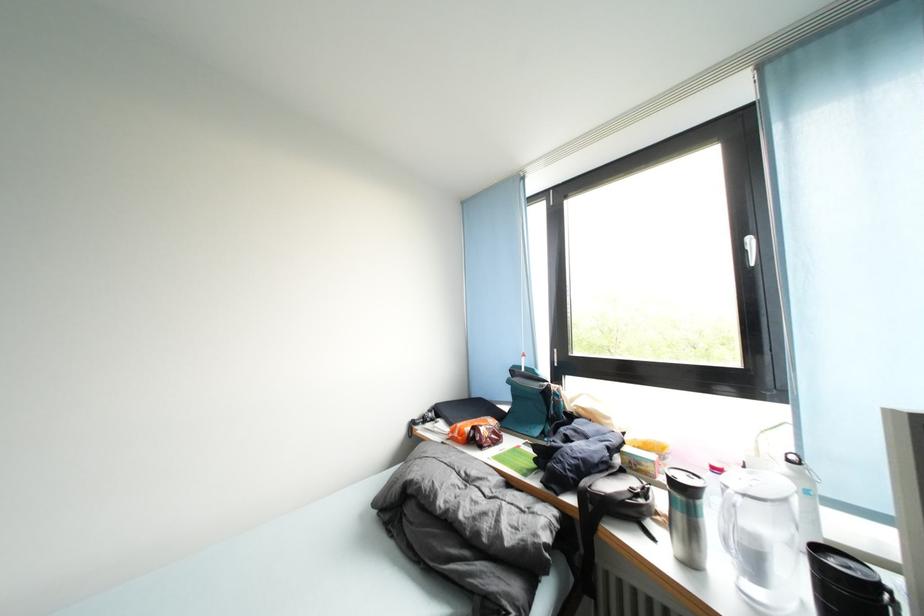
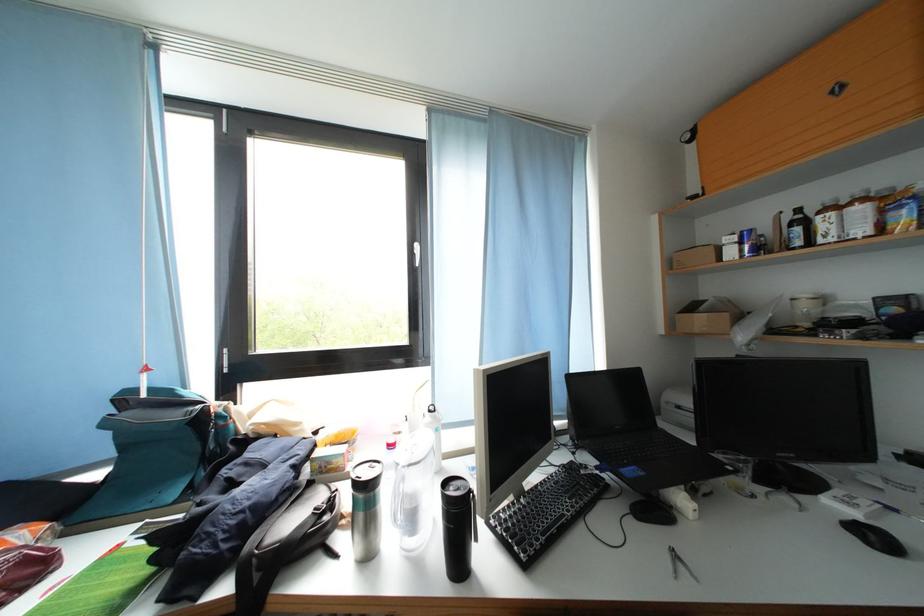
The point at (723, 475) is marked in the first image. Where is the corresponding point in the second image?

(398, 451)